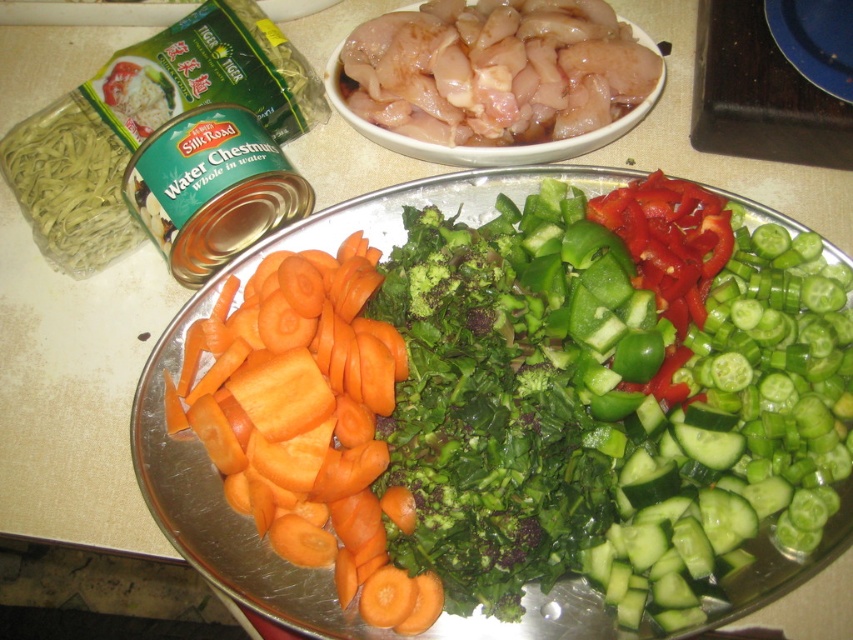
Can you confirm if pale pink glossy chicken at upper center is thinner than green leafy broccoli at center?

No.

Does point (378, 60) come in front of point (418, 310)?

No.

Identify the location of pale pink glossy chicken at upper center. The width and height of the screenshot is (853, 640). [495, 70].

Can you confirm if orange smooth carrot at center-left is smaller than green leafy broccoli at center?

Incorrect, orange smooth carrot at center-left is not smaller in size than green leafy broccoli at center.

In order to click on orange smooth carrot at center-left in this screenshot , I will do `click(306, 420)`.

What do you see at coordinates (735, 433) in the screenshot? This screenshot has height=640, width=853. I see `green smooth cucumber at center` at bounding box center [735, 433].

Which is in front, point (833, 385) or point (527, 83)?

Point (833, 385) is in front.

What do you see at coordinates (735, 433) in the screenshot?
I see `green smooth cucumber at center` at bounding box center [735, 433].

Identify the location of green smooth cucumber at center. This screenshot has height=640, width=853. coord(735,433).